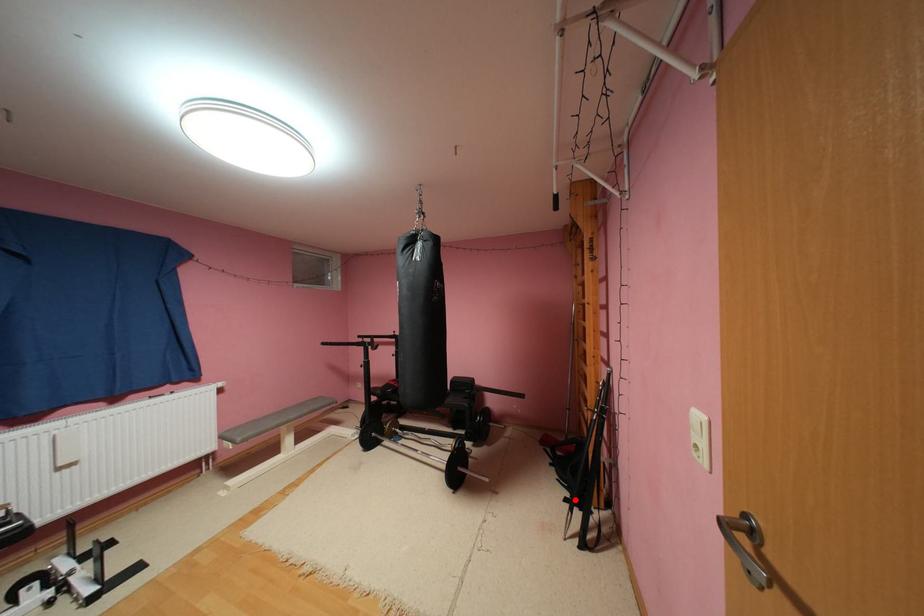
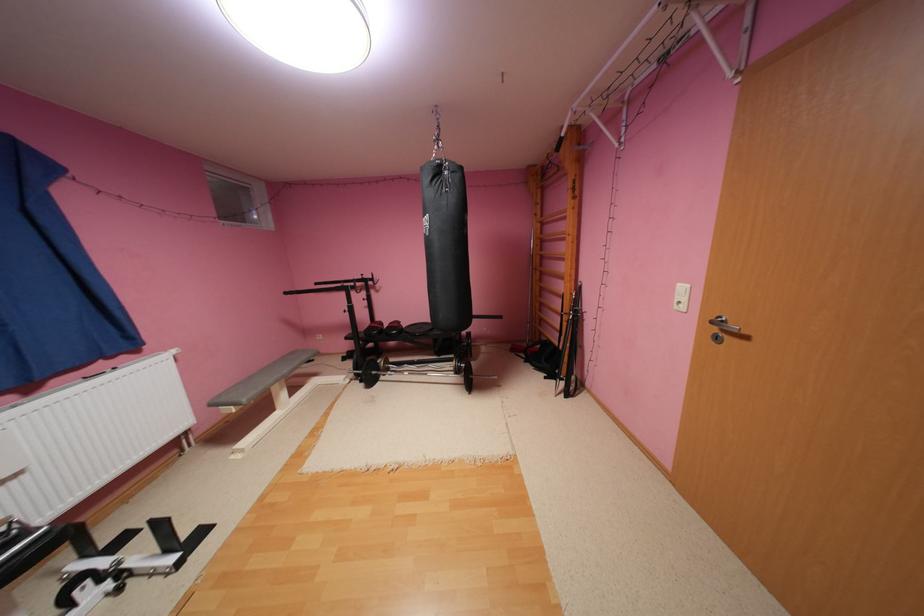
In the second image, find the point that corresponds to the highlighted location in the first image.

(554, 378)